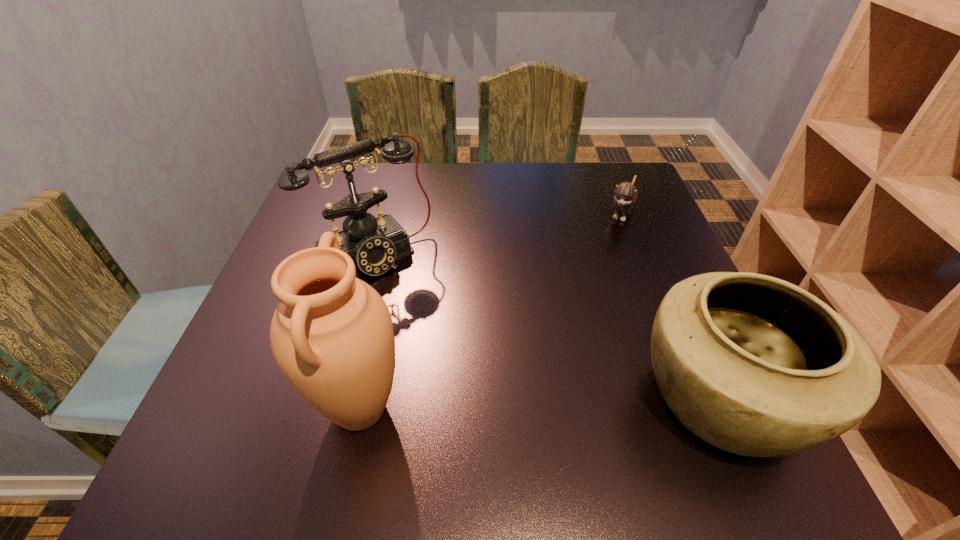
Identify the location of free spot on the desktop that is between the urn and the pottery and is positioned on the front-facing side of the kitten. (526, 404).

This screenshot has height=540, width=960. Find the location of `vacant space on the desktop that is between the urn and the pottery and is positioned on the dial of the second tallest object`. vacant space on the desktop that is between the urn and the pottery and is positioned on the dial of the second tallest object is located at coordinates point(494,405).